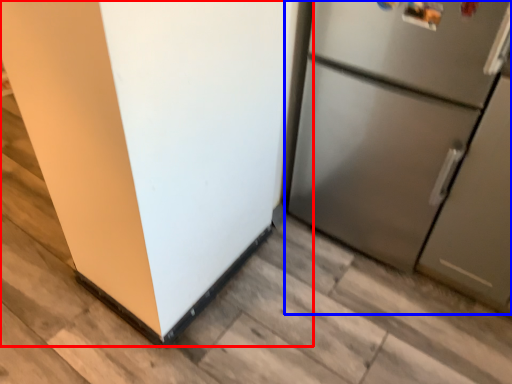
Question: Which of the following is the farthest to the observer, refrigerator (highlighted by a red box) or refrigerator (highlighted by a blue box)?

Choices:
 (A) refrigerator
 (B) refrigerator

Answer: (B)